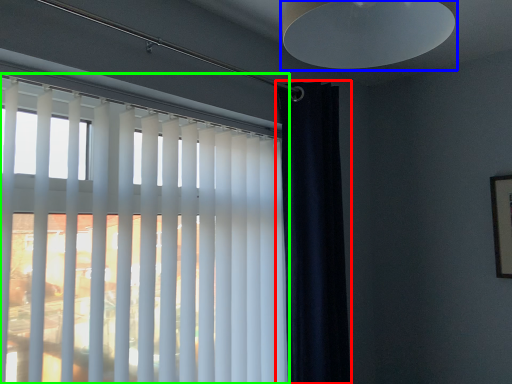
Question: Considering the real-world distances, which object is closest to curtain (highlighted by a red box)? lamp (highlighted by a blue box) or window blind (highlighted by a green box).

Choices:
 (A) lamp
 (B) window blind

Answer: (B)